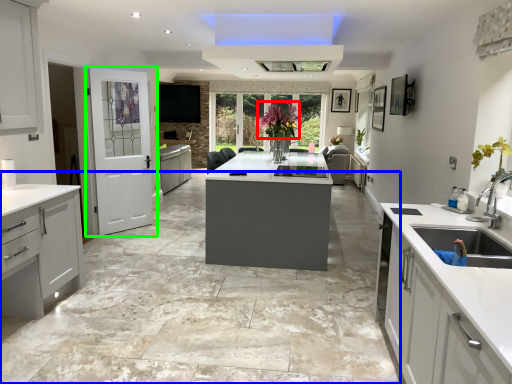
Question: Estimate the real-world distances between objects in this image. Which object is closer to floral arrangement (highlighted by a red box), concrete (highlighted by a blue box) or door (highlighted by a green box)?

Choices:
 (A) concrete
 (B) door

Answer: (B)